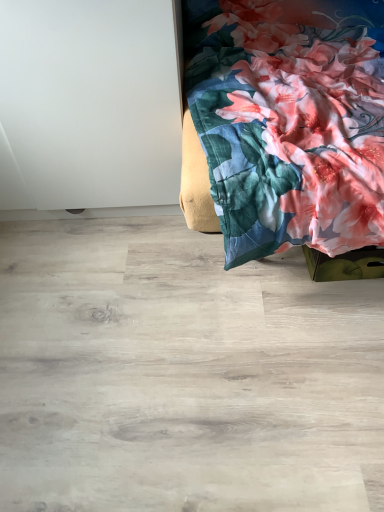
Question: Considering the positions of floral fabric bedspread at upper right and natural wood floor at lower center in the image, is floral fabric bedspread at upper right wider or thinner than natural wood floor at lower center?

Choices:
 (A) thin
 (B) wide

Answer: (A)

Question: Which is correct: floral fabric bedspread at upper right is inside natural wood floor at lower center, or outside of it?

Choices:
 (A) outside
 (B) inside

Answer: (A)

Question: From the image's perspective, relative to natural wood floor at lower center, is floral fabric bedspread at upper right above or below?

Choices:
 (A) above
 (B) below

Answer: (A)

Question: Is natural wood floor at lower center taller or shorter than floral fabric bedspread at upper right?

Choices:
 (A) tall
 (B) short

Answer: (B)

Question: Considering the positions of point click(223, 500) and point click(246, 243), is point click(223, 500) closer or farther from the camera than point click(246, 243)?

Choices:
 (A) closer
 (B) farther

Answer: (A)

Question: In terms of width, does natural wood floor at lower center look wider or thinner when compared to floral fabric bedspread at upper right?

Choices:
 (A) wide
 (B) thin

Answer: (A)

Question: Considering the relative positions of natural wood floor at lower center and floral fabric bedspread at upper right in the image provided, is natural wood floor at lower center to the left or to the right of floral fabric bedspread at upper right?

Choices:
 (A) left
 (B) right

Answer: (A)